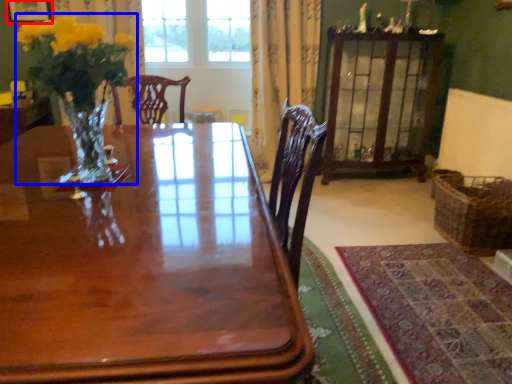
Question: Which object appears farthest to the camera in this image, picture frame (highlighted by a red box) or floral arrangement (highlighted by a blue box)?

Choices:
 (A) picture frame
 (B) floral arrangement

Answer: (A)